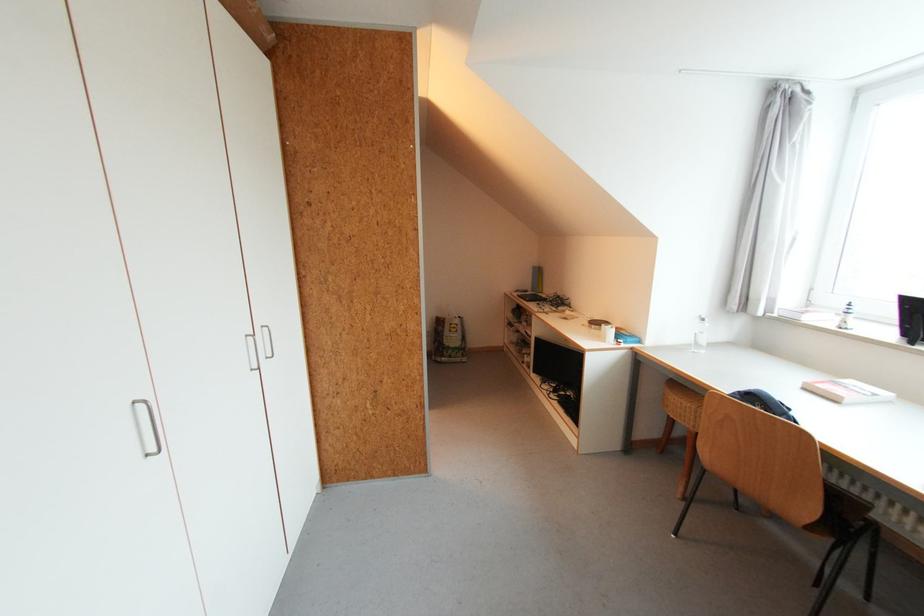
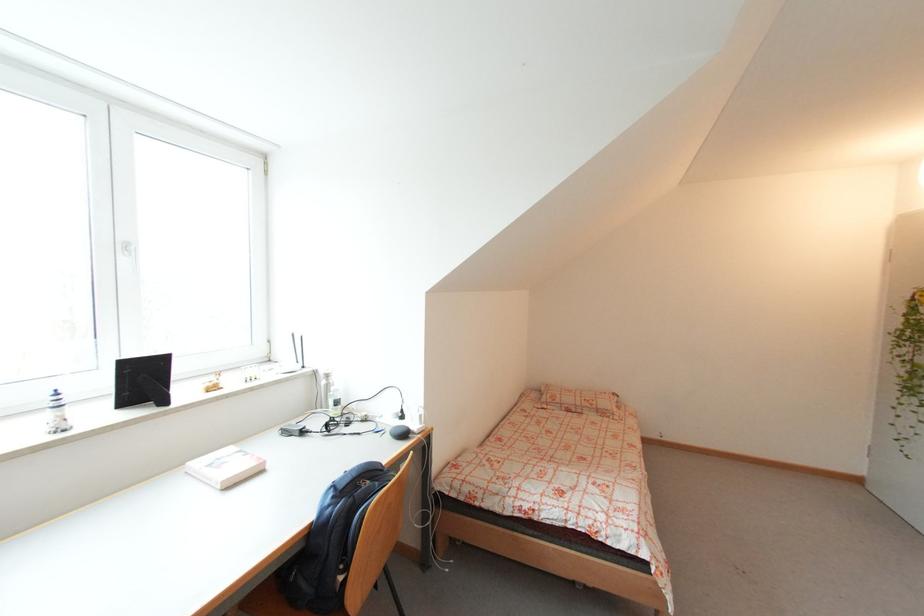
The point at (892, 395) is marked in the first image. Where is the corresponding point in the second image?

(236, 450)